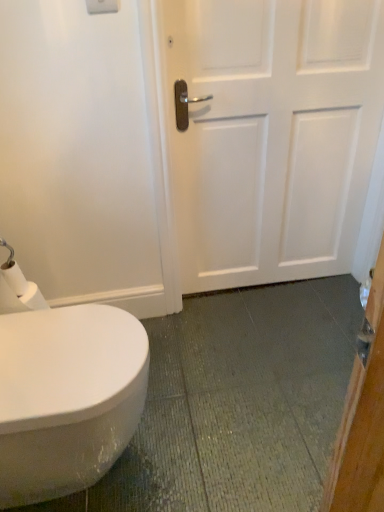
Question: Is white matte toilet paper at lower left inside the boundaries of white matte door at center, or outside?

Choices:
 (A) outside
 (B) inside

Answer: (A)

Question: Is point (11, 273) closer or farther from the camera than point (271, 94)?

Choices:
 (A) farther
 (B) closer

Answer: (B)

Question: Which of these objects is positioned farthest from the white glossy bidet at lower left?

Choices:
 (A) white matte door at center
 (B) white matte toilet paper at lower left

Answer: (A)

Question: Which is nearer to the white glossy bidet at lower left?

Choices:
 (A) white matte toilet paper at lower left
 (B) white matte door at center

Answer: (A)